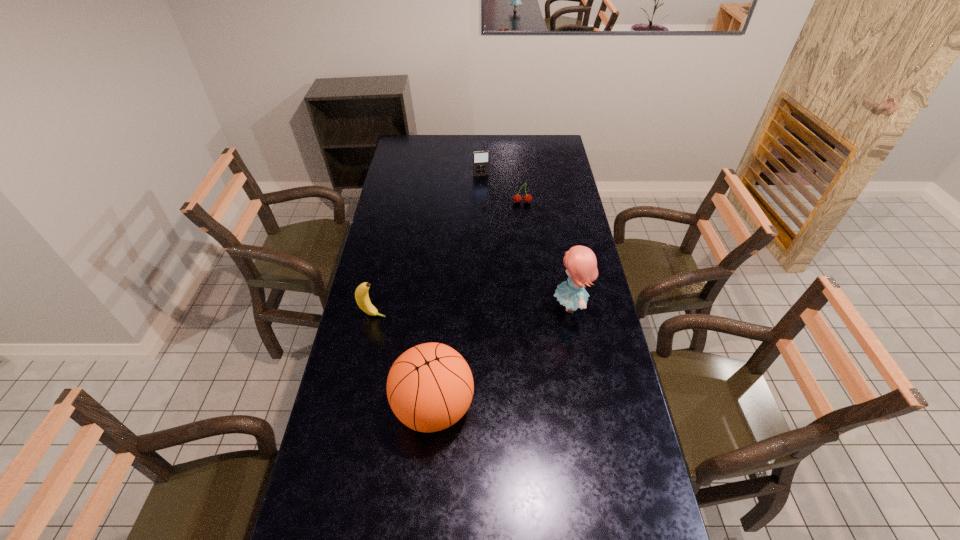
The height and width of the screenshot is (540, 960). Identify the location of the fourth shortest object. (430, 387).

Find the location of a particular element. This screenshot has height=540, width=960. basketball is located at coordinates (430, 387).

Find the location of a particular element. The height and width of the screenshot is (540, 960). doll is located at coordinates (581, 265).

The image size is (960, 540). Identify the location of the second farthest object. (527, 198).

At what (x,y) coordinates should I click in order to perform the action: click on cherry. Please return your answer as a coordinate pair (x, y). The image size is (960, 540). Looking at the image, I should click on (527, 198).

The height and width of the screenshot is (540, 960). I want to click on the third shortest object, so click(361, 294).

Where is `the leftmost object`? the leftmost object is located at coordinates (361, 294).

You are a GUI agent. You are given a task and a screenshot of the screen. Output one action in this format:
    pyautogui.click(x=<x>, y=<y>)
    Task: Click on the farthest object
    
    Given the screenshot: What is the action you would take?
    pyautogui.click(x=480, y=158)

Find the location of a particular element. iPod is located at coordinates (480, 158).

Locate an element on the screen. The width and height of the screenshot is (960, 540). vacant space situated 0.070m on the right of the fourth shortest object is located at coordinates (497, 407).